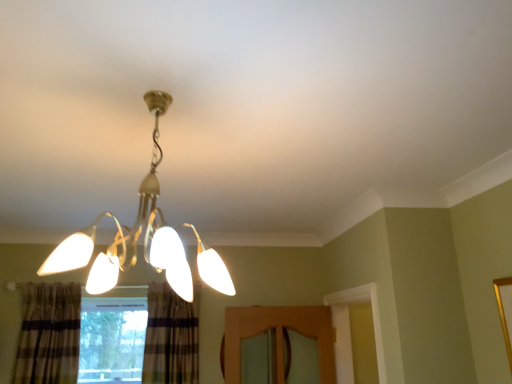
The image size is (512, 384). What are the coordinates of `plaid fabric curtain at lower center, which is the first curtain from right to left` in the screenshot? It's located at (170, 337).

Where is `plaid fabric curtain at lower center, which is the first curtain from right to left`? plaid fabric curtain at lower center, which is the first curtain from right to left is located at coordinates (170, 337).

Considering the relative positions of plaid fabric curtain at lower center, the 2th curtain positioned from the left, and clear glass window at lower left in the image provided, is plaid fabric curtain at lower center, the 2th curtain positioned from the left, to the left or to the right of clear glass window at lower left?

From the image, it's evident that plaid fabric curtain at lower center, the 2th curtain positioned from the left, is to the right of clear glass window at lower left.

Who is shorter, plaid fabric curtain at lower center, which is the first curtain from right to left, or clear glass window at lower left?

clear glass window at lower left.

Is plaid fabric curtain at lower center, which is the first curtain from right to left, directly adjacent to clear glass window at lower left?

No.

Based on the photo, considering the relative sizes of plaid fabric curtain at lower center, the 2th curtain positioned from the left, and plaid fabric curtain at lower left, which appears as the 2th curtain when viewed from the right, in the image provided, is plaid fabric curtain at lower center, the 2th curtain positioned from the left, taller than plaid fabric curtain at lower left, which appears as the 2th curtain when viewed from the right,?

Yes.

From the image's perspective, is plaid fabric curtain at lower center, which is the first curtain from right to left, beneath plaid fabric curtain at lower left, which is counted as the 1th curtain, starting from the left?

Indeed, from the image's perspective, plaid fabric curtain at lower center, which is the first curtain from right to left, is shown beneath plaid fabric curtain at lower left, which is counted as the 1th curtain, starting from the left.

What's the angular difference between plaid fabric curtain at lower center, which is the first curtain from right to left, and plaid fabric curtain at lower left, which appears as the 2th curtain when viewed from the right,'s facing directions?

The angular difference between plaid fabric curtain at lower center, which is the first curtain from right to left, and plaid fabric curtain at lower left, which appears as the 2th curtain when viewed from the right, is 0.447 degrees.

Considering the sizes of objects plaid fabric curtain at lower left, which appears as the 2th curtain when viewed from the right, and plaid fabric curtain at lower center, which is the first curtain from right to left, in the image provided, who is bigger, plaid fabric curtain at lower left, which appears as the 2th curtain when viewed from the right, or plaid fabric curtain at lower center, which is the first curtain from right to left,?

With larger size is plaid fabric curtain at lower center, which is the first curtain from right to left.

In terms of height, does plaid fabric curtain at lower left, which is counted as the 1th curtain, starting from the left, look taller or shorter compared to plaid fabric curtain at lower center, the 2th curtain positioned from the left?

Clearly, plaid fabric curtain at lower left, which is counted as the 1th curtain, starting from the left, is shorter compared to plaid fabric curtain at lower center, the 2th curtain positioned from the left.

From the image's perspective, is plaid fabric curtain at lower left, which appears as the 2th curtain when viewed from the right, over plaid fabric curtain at lower center, the 2th curtain positioned from the left?

Correct, plaid fabric curtain at lower left, which appears as the 2th curtain when viewed from the right, appears higher than plaid fabric curtain at lower center, the 2th curtain positioned from the left, in the image.

Consider the image. Measure the distance between plaid fabric curtain at lower left, which is counted as the 1th curtain, starting from the left, and plaid fabric curtain at lower center, the 2th curtain positioned from the left.

The distance of plaid fabric curtain at lower left, which is counted as the 1th curtain, starting from the left, from plaid fabric curtain at lower center, the 2th curtain positioned from the left, is 61.21 centimeters.

Based on the photo, considering the relative sizes of plaid fabric curtain at lower center, the 2th curtain positioned from the left, and matte gold chandelier at center in the image provided, is plaid fabric curtain at lower center, the 2th curtain positioned from the left, thinner than matte gold chandelier at center?

Yes, plaid fabric curtain at lower center, the 2th curtain positioned from the left, is thinner than matte gold chandelier at center.

From a real-world perspective, does plaid fabric curtain at lower center, which is the first curtain from right to left, sit lower than matte gold chandelier at center?

Correct, in the physical world, plaid fabric curtain at lower center, which is the first curtain from right to left, is lower than matte gold chandelier at center.

Is plaid fabric curtain at lower center, which is the first curtain from right to left, smaller than matte gold chandelier at center?

Yes.

Is plaid fabric curtain at lower center, the 2th curtain positioned from the left, not close to matte gold chandelier at center?

Absolutely, plaid fabric curtain at lower center, the 2th curtain positioned from the left, is distant from matte gold chandelier at center.

Measure the distance from matte gold chandelier at center to plaid fabric curtain at lower left, which appears as the 2th curtain when viewed from the right.

They are 5.57 feet apart.

From the image's perspective, would you say matte gold chandelier at center is shown under plaid fabric curtain at lower left, which is counted as the 1th curtain, starting from the left?

No.

Looking at this image, from a real-world perspective, which is physically below, matte gold chandelier at center or plaid fabric curtain at lower left, which is counted as the 1th curtain, starting from the left?

plaid fabric curtain at lower left, which is counted as the 1th curtain, starting from the left, is physically lower.

Does matte gold chandelier at center touch plaid fabric curtain at lower left, which is counted as the 1th curtain, starting from the left?

matte gold chandelier at center and plaid fabric curtain at lower left, which is counted as the 1th curtain, starting from the left, are not in contact.

Is clear glass window at lower left turned away from matte gold chandelier at center?

No, clear glass window at lower left is not facing the opposite direction of matte gold chandelier at center.

In the image, is clear glass window at lower left on the left side or the right side of matte gold chandelier at center?

Based on their positions, clear glass window at lower left is located to the left of matte gold chandelier at center.

Is clear glass window at lower left not inside matte gold chandelier at center?

Yes, clear glass window at lower left is outside of matte gold chandelier at center.

From the image's perspective, relative to matte gold chandelier at center, is clear glass window at lower left above or below?

Clearly, from the image's perspective, clear glass window at lower left is below matte gold chandelier at center.

From the image's perspective, would you say plaid fabric curtain at lower left, which is counted as the 1th curtain, starting from the left, is shown under matte gold chandelier at center?

Yes.

Would you consider plaid fabric curtain at lower left, which appears as the 2th curtain when viewed from the right, to be distant from matte gold chandelier at center?

plaid fabric curtain at lower left, which appears as the 2th curtain when viewed from the right, is positioned a significant distance from matte gold chandelier at center.

Find the location of a particular element. The width and height of the screenshot is (512, 384). lamp that appears above the plaid fabric curtain at lower left, which is counted as the 1th curtain, starting from the left (from a real-world perspective) is located at coordinates (130, 234).

Locate an element on the screen. The image size is (512, 384). window below the plaid fabric curtain at lower center, the 2th curtain positioned from the left (from the image's perspective) is located at coordinates (112, 339).

You are a GUI agent. You are given a task and a screenshot of the screen. Output one action in this format:
    pyautogui.click(x=<x>, y=<y>)
    Task: Click on the curtain lying in front of the plaid fabric curtain at lower center, which is the first curtain from right to left
    This screenshot has width=512, height=384.
    Given the screenshot: What is the action you would take?
    pyautogui.click(x=48, y=334)

Consider the image. Which object lies nearer to the anchor point plaid fabric curtain at lower left, which is counted as the 1th curtain, starting from the left, matte gold chandelier at center or plaid fabric curtain at lower center, the 2th curtain positioned from the left?

plaid fabric curtain at lower center, the 2th curtain positioned from the left, is closer to plaid fabric curtain at lower left, which is counted as the 1th curtain, starting from the left.

From the image, which object appears to be nearer to plaid fabric curtain at lower center, the 2th curtain positioned from the left, plaid fabric curtain at lower left, which is counted as the 1th curtain, starting from the left, or matte gold chandelier at center?

plaid fabric curtain at lower left, which is counted as the 1th curtain, starting from the left, lies closer to plaid fabric curtain at lower center, the 2th curtain positioned from the left, than the other object.

Based on their spatial positions, is matte gold chandelier at center or clear glass window at lower left further from plaid fabric curtain at lower left, which is counted as the 1th curtain, starting from the left?

Based on the image, matte gold chandelier at center appears to be further to plaid fabric curtain at lower left, which is counted as the 1th curtain, starting from the left.

From the image, which object appears to be farther from plaid fabric curtain at lower left, which is counted as the 1th curtain, starting from the left, plaid fabric curtain at lower center, which is the first curtain from right to left, or matte gold chandelier at center?

Based on the image, matte gold chandelier at center appears to be further to plaid fabric curtain at lower left, which is counted as the 1th curtain, starting from the left.

From the image, which object appears to be farther from matte gold chandelier at center, clear glass window at lower left or plaid fabric curtain at lower center, which is the first curtain from right to left?

Based on the image, clear glass window at lower left appears to be further to matte gold chandelier at center.

From the picture: Estimate the real-world distances between objects in this image. Which object is closer to matte gold chandelier at center, plaid fabric curtain at lower center, which is the first curtain from right to left, or clear glass window at lower left?

plaid fabric curtain at lower center, which is the first curtain from right to left.

Considering their positions, is plaid fabric curtain at lower left, which appears as the 2th curtain when viewed from the right, positioned closer to matte gold chandelier at center than clear glass window at lower left?

plaid fabric curtain at lower left, which appears as the 2th curtain when viewed from the right, is positioned closer to the anchor matte gold chandelier at center.

Which object lies further to the anchor point clear glass window at lower left, plaid fabric curtain at lower center, the 2th curtain positioned from the left, or matte gold chandelier at center?

matte gold chandelier at center is further to clear glass window at lower left.

Where is `curtain positioned between matte gold chandelier at center and plaid fabric curtain at lower center, which is the first curtain from right to left, from near to far`? This screenshot has height=384, width=512. curtain positioned between matte gold chandelier at center and plaid fabric curtain at lower center, which is the first curtain from right to left, from near to far is located at coordinates (48, 334).

Locate an element on the screen. The width and height of the screenshot is (512, 384). window located between plaid fabric curtain at lower left, which appears as the 2th curtain when viewed from the right, and plaid fabric curtain at lower center, the 2th curtain positioned from the left, in the left-right direction is located at coordinates (112, 339).